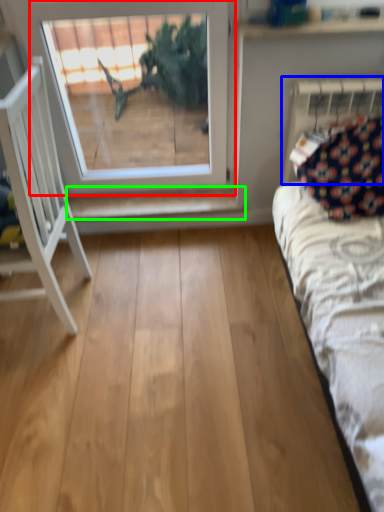
Question: Which object is the farthest from window (highlighted by a red box)? Choose among these: radiator (highlighted by a blue box) or shelf (highlighted by a green box).

Choices:
 (A) radiator
 (B) shelf

Answer: (A)